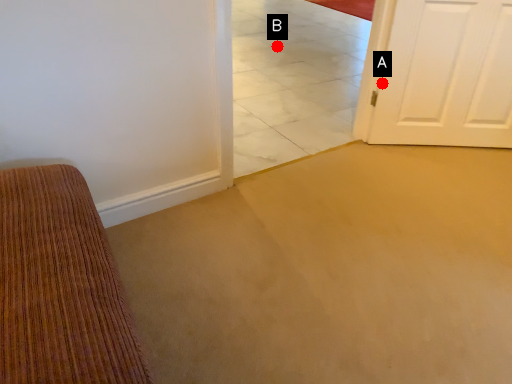
Question: Two points are circled on the image, labeled by A and B beside each circle. Which point is closer to the camera?

Choices:
 (A) A is closer
 (B) B is closer

Answer: (A)